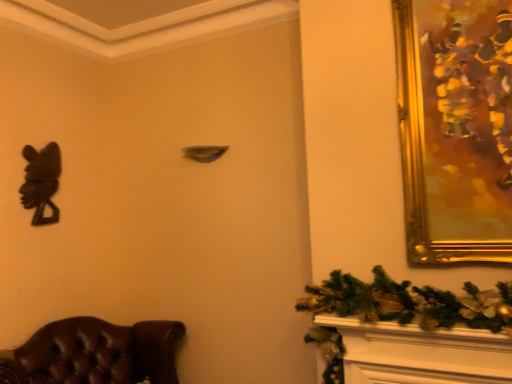
Question: Is black matte sculpture at left turned away from gold/gilded picture frame at upper right?

Choices:
 (A) no
 (B) yes

Answer: (A)

Question: From a real-world perspective, is black matte sculpture at left located beneath gold/gilded picture frame at upper right?

Choices:
 (A) yes
 (B) no

Answer: (A)

Question: Is gold/gilded picture frame at upper right completely or partially inside black matte sculpture at left?

Choices:
 (A) no
 (B) yes

Answer: (A)

Question: Is black matte sculpture at left shorter than gold/gilded picture frame at upper right?

Choices:
 (A) no
 (B) yes

Answer: (B)

Question: Is black matte sculpture at left wider than gold/gilded picture frame at upper right?

Choices:
 (A) no
 (B) yes

Answer: (A)

Question: Does black matte sculpture at left turn towards gold/gilded picture frame at upper right?

Choices:
 (A) yes
 (B) no

Answer: (A)

Question: From a real-world perspective, is brown leather chair at lower left below gold/gilded picture frame at upper right?

Choices:
 (A) yes
 (B) no

Answer: (A)

Question: Can you confirm if brown leather chair at lower left is wider than gold/gilded picture frame at upper right?

Choices:
 (A) yes
 (B) no

Answer: (A)

Question: Is gold/gilded picture frame at upper right a part of brown leather chair at lower left?

Choices:
 (A) yes
 (B) no

Answer: (B)

Question: Is brown leather chair at lower left oriented away from gold/gilded picture frame at upper right?

Choices:
 (A) yes
 (B) no

Answer: (B)

Question: Considering the relative sizes of brown leather chair at lower left and gold/gilded picture frame at upper right in the image provided, is brown leather chair at lower left smaller than gold/gilded picture frame at upper right?

Choices:
 (A) no
 (B) yes

Answer: (A)

Question: Is brown leather chair at lower left bigger than gold/gilded picture frame at upper right?

Choices:
 (A) no
 (B) yes

Answer: (B)

Question: Does gold/gilded picture frame at upper right have a lesser width compared to black matte sculpture at left?

Choices:
 (A) yes
 (B) no

Answer: (B)